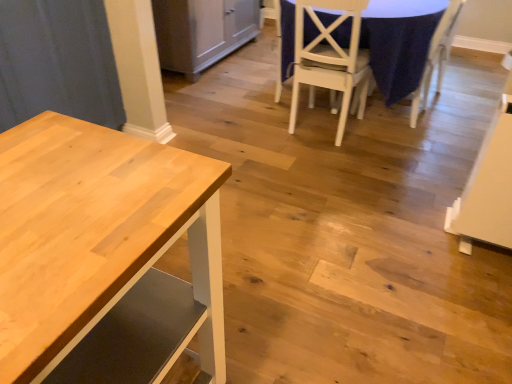
What do you see at coordinates (330, 58) in the screenshot? The width and height of the screenshot is (512, 384). I see `white matte chair at center, the 1th chair from the left` at bounding box center [330, 58].

Measure the distance between matte gray cabinet at center and camera.

matte gray cabinet at center is 10.03 feet away from camera.

At what (x,y) coordinates should I click in order to perform the action: click on natural wood table at left. Please return your answer as a coordinate pair (x, y). The width and height of the screenshot is (512, 384). Looking at the image, I should click on (104, 255).

Locate an element on the screen. This screenshot has width=512, height=384. white fabric chair at upper right, the 1th chair in the right-to-left sequence is located at coordinates (436, 57).

Is point (413, 116) more distant than point (185, 337)?

Yes.

Is white fabric chair at upper right, acting as the 2th chair starting from the left, with natural wood table at left?

No, white fabric chair at upper right, acting as the 2th chair starting from the left, is not touching natural wood table at left.

From the natural wood table at left, count 2nd chairs backward and point to it. Please provide its 2D coordinates.

[(436, 57)]

From the image's perspective, who appears lower, white fabric chair at upper right, acting as the 2th chair starting from the left, or natural wood table at left?

natural wood table at left.

In the scene shown: Is white matte chair at center, the 1th chair from the left, inside blue fabric tablecloth at center?

Yes, white matte chair at center, the 1th chair from the left, is a part of blue fabric tablecloth at center.

From a real-world perspective, is blue fabric tablecloth at center physically below white matte chair at center, the 1th chair from the left?

Yes, from a real-world perspective, blue fabric tablecloth at center is beneath white matte chair at center, the 1th chair from the left.

Considering the relative sizes of blue fabric tablecloth at center and white matte chair at center, the 1th chair from the left, in the image provided, is blue fabric tablecloth at center shorter than white matte chair at center, the 1th chair from the left,?

Yes, blue fabric tablecloth at center is shorter than white matte chair at center, the 1th chair from the left.

Is natural wood table at left aimed at matte gray cabinet at center?

No, natural wood table at left is not turned towards matte gray cabinet at center.

Can we say natural wood table at left lies outside matte gray cabinet at center?

natural wood table at left lies outside matte gray cabinet at center's area.

Can you confirm if natural wood table at left is shorter than matte gray cabinet at center?

In fact, natural wood table at left may be taller than matte gray cabinet at center.

How many degrees apart are the facing directions of natural wood table at left and matte gray cabinet at center?

The angular difference between natural wood table at left and matte gray cabinet at center is 1.43 degrees.

Could you tell me if white matte chair at center, the 2th chair viewed from the right, is facing natural wood table at left?

No, white matte chair at center, the 2th chair viewed from the right, is not aimed at natural wood table at left.

From a real-world perspective, is white matte chair at center, the 1th chair from the left, positioned over natural wood table at left based on gravity?

No, from a real-world perspective, white matte chair at center, the 1th chair from the left, is not over natural wood table at left

Is white matte chair at center, the 1th chair from the left, looking in the opposite direction of matte gray cabinet at center?

No, white matte chair at center, the 1th chair from the left,'s orientation is not away from matte gray cabinet at center.

Are white matte chair at center, the 2th chair viewed from the right, and matte gray cabinet at center far apart?

Yes, white matte chair at center, the 2th chair viewed from the right, and matte gray cabinet at center are quite far apart.

What's the angular difference between white matte chair at center, the 1th chair from the left, and matte gray cabinet at center's facing directions?

There is a 94.6-degree angle between the facing directions of white matte chair at center, the 1th chair from the left, and matte gray cabinet at center.

Considering the positions of objects white matte chair at center, the 1th chair from the left, and white fabric chair at upper right, the 1th chair in the right-to-left sequence, in the image provided, who is more to the left, white matte chair at center, the 1th chair from the left, or white fabric chair at upper right, the 1th chair in the right-to-left sequence,?

From the viewer's perspective, white matte chair at center, the 1th chair from the left, appears more on the left side.

Can you confirm if white matte chair at center, the 2th chair viewed from the right, is bigger than white fabric chair at upper right, the 1th chair in the right-to-left sequence?

Correct, white matte chair at center, the 2th chair viewed from the right, is larger in size than white fabric chair at upper right, the 1th chair in the right-to-left sequence.

In the scene shown: From the image's perspective, is white matte chair at center, the 1th chair from the left, over white fabric chair at upper right, acting as the 2th chair starting from the left?

Incorrect, from the image's perspective, white matte chair at center, the 1th chair from the left, is lower than white fabric chair at upper right, acting as the 2th chair starting from the left.

Is white matte chair at center, the 2th chair viewed from the right, next to white fabric chair at upper right, acting as the 2th chair starting from the left, and touching it?

There is a gap between white matte chair at center, the 2th chair viewed from the right, and white fabric chair at upper right, acting as the 2th chair starting from the left.

From a real-world perspective, is natural wood table at left positioned above or below white fabric chair at upper right, acting as the 2th chair starting from the left?

From a real-world perspective, natural wood table at left is physically above white fabric chair at upper right, acting as the 2th chair starting from the left.

Is natural wood table at left wider than white fabric chair at upper right, the 1th chair in the right-to-left sequence?

Yes, natural wood table at left is wider than white fabric chair at upper right, the 1th chair in the right-to-left sequence.

Considering the sizes of objects natural wood table at left and white fabric chair at upper right, acting as the 2th chair starting from the left, in the image provided, who is taller, natural wood table at left or white fabric chair at upper right, acting as the 2th chair starting from the left,?

With more height is natural wood table at left.

Choose the correct answer: Is natural wood table at left inside white fabric chair at upper right, acting as the 2th chair starting from the left, or outside it?

The correct answer is: outside.

Locate an element on the screen. The image size is (512, 384). table above the white fabric chair at upper right, the 1th chair in the right-to-left sequence (from a real-world perspective) is located at coordinates (104, 255).

This screenshot has height=384, width=512. Find the location of `tablecloth beneath the white matte chair at center, the 2th chair viewed from the right (from a real-world perspective)`. tablecloth beneath the white matte chair at center, the 2th chair viewed from the right (from a real-world perspective) is located at coordinates (398, 50).

Looking at the image, which one is located further to natural wood table at left, white matte chair at center, the 2th chair viewed from the right, or matte gray cabinet at center?

matte gray cabinet at center is further to natural wood table at left.

Looking at the image, which one is located closer to white fabric chair at upper right, acting as the 2th chair starting from the left, natural wood table at left or blue fabric tablecloth at center?

Based on the image, blue fabric tablecloth at center appears to be nearer to white fabric chair at upper right, acting as the 2th chair starting from the left.

From the picture: Considering their positions, is white fabric chair at upper right, the 1th chair in the right-to-left sequence, positioned further to white matte chair at center, the 2th chair viewed from the right, than natural wood table at left?

natural wood table at left lies further to white matte chair at center, the 2th chair viewed from the right, than the other object.

Based on their spatial positions, is white fabric chair at upper right, acting as the 2th chair starting from the left, or blue fabric tablecloth at center further from matte gray cabinet at center?

Based on the image, white fabric chair at upper right, acting as the 2th chair starting from the left, appears to be further to matte gray cabinet at center.

When comparing their distances from white fabric chair at upper right, the 1th chair in the right-to-left sequence, does matte gray cabinet at center or white matte chair at center, the 2th chair viewed from the right, seem further?

The object further to white fabric chair at upper right, the 1th chair in the right-to-left sequence, is matte gray cabinet at center.

Considering their positions, is matte gray cabinet at center positioned closer to white fabric chair at upper right, the 1th chair in the right-to-left sequence, than natural wood table at left?

matte gray cabinet at center lies closer to white fabric chair at upper right, the 1th chair in the right-to-left sequence, than the other object.

Which object lies nearer to the anchor point blue fabric tablecloth at center, natural wood table at left or white matte chair at center, the 2th chair viewed from the right?

white matte chair at center, the 2th chair viewed from the right, is closer to blue fabric tablecloth at center.

Based on their spatial positions, is white fabric chair at upper right, the 1th chair in the right-to-left sequence, or blue fabric tablecloth at center closer to natural wood table at left?

Among the two, blue fabric tablecloth at center is located nearer to natural wood table at left.

You are a GUI agent. You are given a task and a screenshot of the screen. Output one action in this format:
    pyautogui.click(x=<x>, y=<y>)
    Task: Click on the chair located between natural wood table at left and white fabric chair at upper right, acting as the 2th chair starting from the left, in the depth direction
    The width and height of the screenshot is (512, 384).
    Given the screenshot: What is the action you would take?
    pyautogui.click(x=330, y=58)

Locate an element on the screen. This screenshot has height=384, width=512. chair located between matte gray cabinet at center and blue fabric tablecloth at center in the left-right direction is located at coordinates (330, 58).

Locate an element on the screen. chair between matte gray cabinet at center and white fabric chair at upper right, acting as the 2th chair starting from the left is located at coordinates (330, 58).

Find the location of a particular element. chair located between natural wood table at left and blue fabric tablecloth at center in the depth direction is located at coordinates (330, 58).